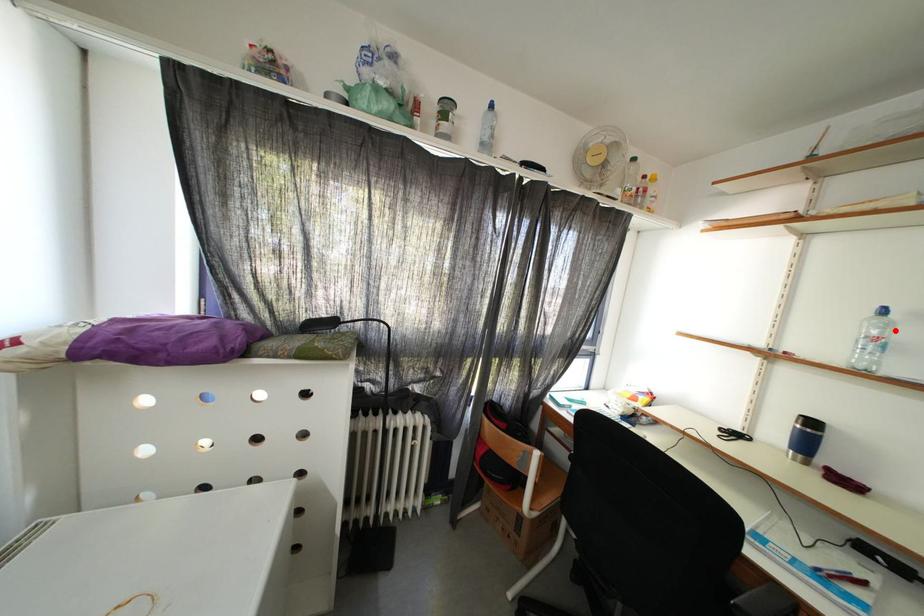
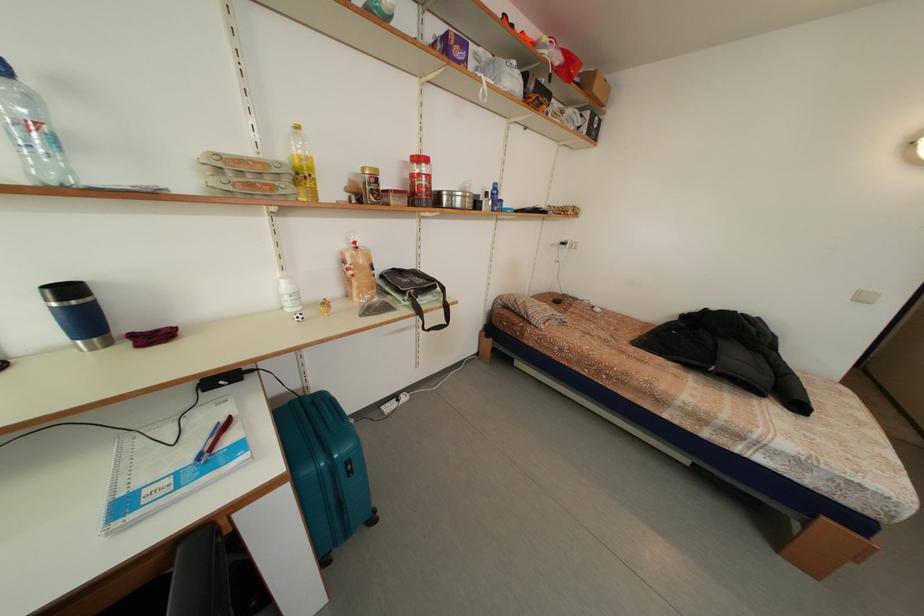
Question: I am providing you with two images of the same scene from different viewpoints. A red point is marked on the first image. At the location where the point appears in image 1, is it still visible in image 2?

Choices:
 (A) Yes
 (B) No

Answer: (A)